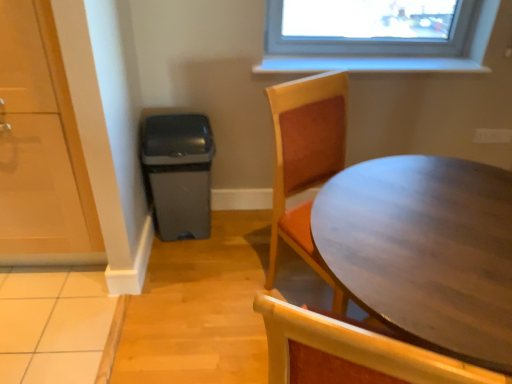
The width and height of the screenshot is (512, 384). What do you see at coordinates (41, 148) in the screenshot?
I see `transparent glass door at left` at bounding box center [41, 148].

This screenshot has height=384, width=512. Find the location of `transparent glass door at left`. transparent glass door at left is located at coordinates (41, 148).

Identify the location of wooden table at right. This screenshot has width=512, height=384. pyautogui.click(x=425, y=251).

What do you see at coordinates (425, 251) in the screenshot?
I see `wooden table at right` at bounding box center [425, 251].

What is the approximate width of wooden table at right?

wooden table at right is 93.43 centimeters in width.

Measure the distance between wooden table at right and camera.

wooden table at right is 26.26 inches away from camera.

Locate an element on the screen. transparent glass door at left is located at coordinates click(41, 148).

Between wooden table at right and transparent glass door at left, which one appears on the left side from the viewer's perspective?

Positioned to the left is transparent glass door at left.

Which object is closer to the camera taking this photo, wooden table at right or transparent glass door at left?

wooden table at right is closer to the camera.

Consider the image. Which point is more distant from viewer, [481,176] or [7,68]?

The point [7,68] is farther from the camera.

From the image's perspective, who appears lower, wooden table at right or transparent glass door at left?

wooden table at right appears lower in the image.

From a real-world perspective, does wooden table at right sit lower than transparent glass door at left?

Yes, from a real-world perspective, wooden table at right is under transparent glass door at left.

Which of these two, wooden table at right or transparent glass door at left, is wider?

wooden table at right.

Who is taller, wooden table at right or transparent glass door at left?

transparent glass door at left.

Which of these two, wooden table at right or transparent glass door at left, is bigger?

wooden table at right is bigger.

Would you say transparent glass door at left is part of wooden table at right's contents?

No, transparent glass door at left is not inside wooden table at right.

Is wooden table at right placed right next to transparent glass door at left?

wooden table at right is not next to transparent glass door at left, and they're not touching.

Is wooden table at right facing towards transparent glass door at left?

No, wooden table at right does not turn towards transparent glass door at left.

You are a GUI agent. You are given a task and a screenshot of the screen. Output one action in this format:
    pyautogui.click(x=<x>, y=<y>)
    Task: Click on the table in front of the transparent glass door at left
    This screenshot has width=512, height=384.
    Given the screenshot: What is the action you would take?
    pyautogui.click(x=425, y=251)

Considering the positions of objects transparent glass door at left and wooden table at right in the image provided, who is more to the right, transparent glass door at left or wooden table at right?

From the viewer's perspective, wooden table at right appears more on the right side.

Does transparent glass door at left lie in front of wooden table at right?

That is False.

Does point (81, 257) come farther from viewer compared to point (431, 178)?

Yes, it is behind point (431, 178).

From the image's perspective, between transparent glass door at left and wooden table at right, who is located below?

wooden table at right.

From a real-world perspective, who is located lower, transparent glass door at left or wooden table at right?

wooden table at right, from a real-world perspective.

Can you confirm if transparent glass door at left is thinner than wooden table at right?

Yes.

Between transparent glass door at left and wooden table at right, which one has less height?

With less height is wooden table at right.

Considering the sizes of objects transparent glass door at left and wooden table at right in the image provided, who is bigger, transparent glass door at left or wooden table at right?

With larger size is wooden table at right.

Would you say transparent glass door at left is inside or outside wooden table at right?

transparent glass door at left is not inside wooden table at right, it's outside.

Is transparent glass door at left next to wooden table at right?

They are not placed beside each other.

Is transparent glass door at left turned away from wooden table at right?

transparent glass door at left does not have its back to wooden table at right.

How many degrees apart are the facing directions of transparent glass door at left and wooden table at right?

0.897 degrees.

Image resolution: width=512 pixels, height=384 pixels. I want to click on screen door lying above the wooden table at right (from the image's perspective), so click(41, 148).

Where is `table that appears below the transparent glass door at left (from a real-world perspective)`? This screenshot has width=512, height=384. table that appears below the transparent glass door at left (from a real-world perspective) is located at coordinates (425, 251).

This screenshot has width=512, height=384. Identify the location of screen door that is behind the wooden table at right. (41, 148).